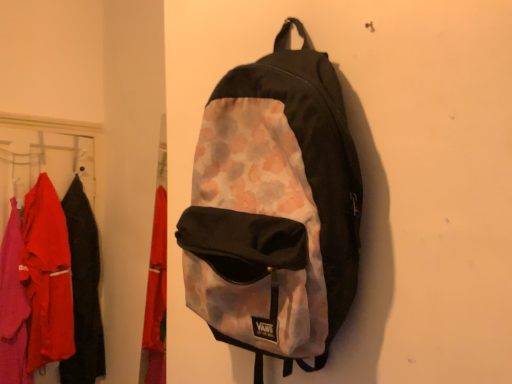
Question: From a real-world perspective, is watercolor-patterned fabric backpack at center physically located above or below matte fabric clothes at left?

Choices:
 (A) below
 (B) above

Answer: (B)

Question: Is watercolor-patterned fabric backpack at center in front of or behind matte fabric clothes at left in the image?

Choices:
 (A) front
 (B) behind

Answer: (A)

Question: Which is farther from the matte black jacket at left?

Choices:
 (A) watercolor-patterned fabric backpack at center
 (B) matte fabric clothes at left

Answer: (A)

Question: Estimate the real-world distances between objects in this image. Which object is closer to the matte fabric clothes at left?

Choices:
 (A) watercolor-patterned fabric backpack at center
 (B) matte black jacket at left

Answer: (B)